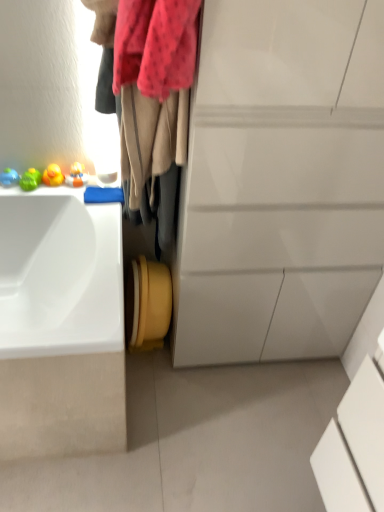
The height and width of the screenshot is (512, 384). Identify the location of vacant area that lies between white glossy cabinet at center and white glossy sink at left. (202, 398).